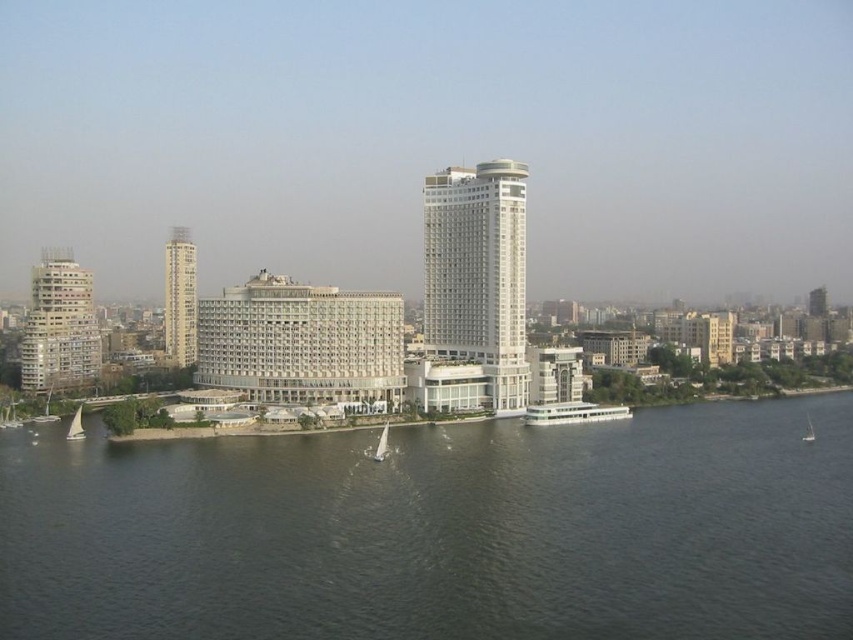
You are a visitor standing at the waterfront and want to take a photo of the matte beige building at left and the smooth beige tower at left. Which one should you focus on first if you want to capture both in the same frame?

The matte beige building at left is below the smooth beige tower at left, so you should focus on the smooth beige tower at left first to ensure both are in the frame.

You are a delivery drone with a wingspan of 4 feet. You need to fly between the matte beige building at left and the smooth beige tower at left. Can you safely navigate the space between them?

The distance between the matte beige building at left and the smooth beige tower at left is 95.53 feet, which is more than sufficient for a drone with a 4 feet wingspan to safely navigate between them.